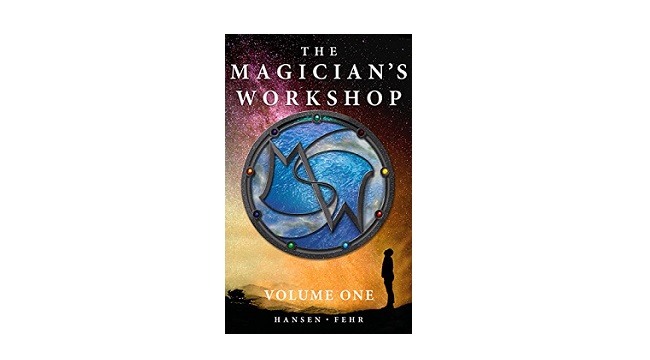
The width and height of the screenshot is (650, 360). What are the coordinates of `book cover` in the screenshot? It's located at (263, 94).